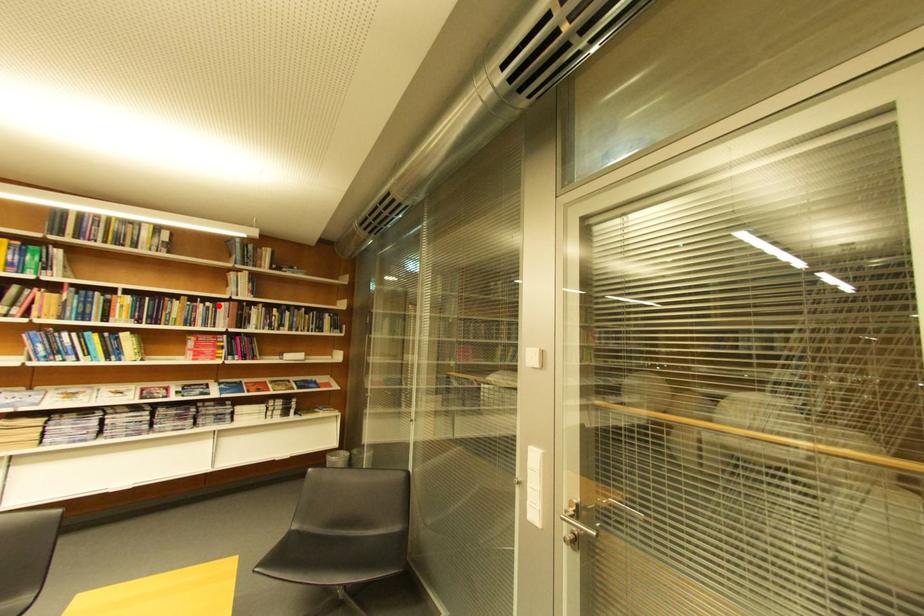
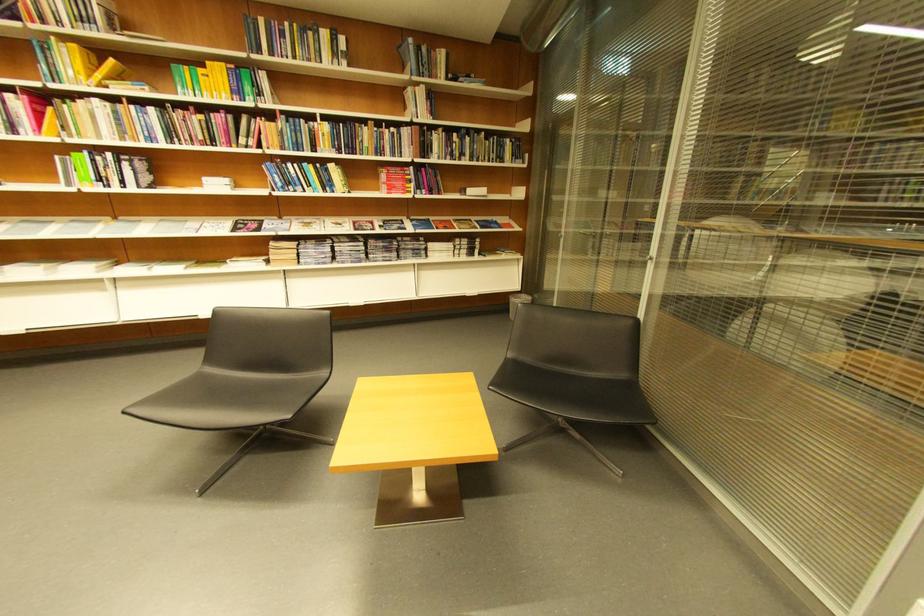
Find the pixel in the second image that matches the highlighted location in the first image.

(403, 131)